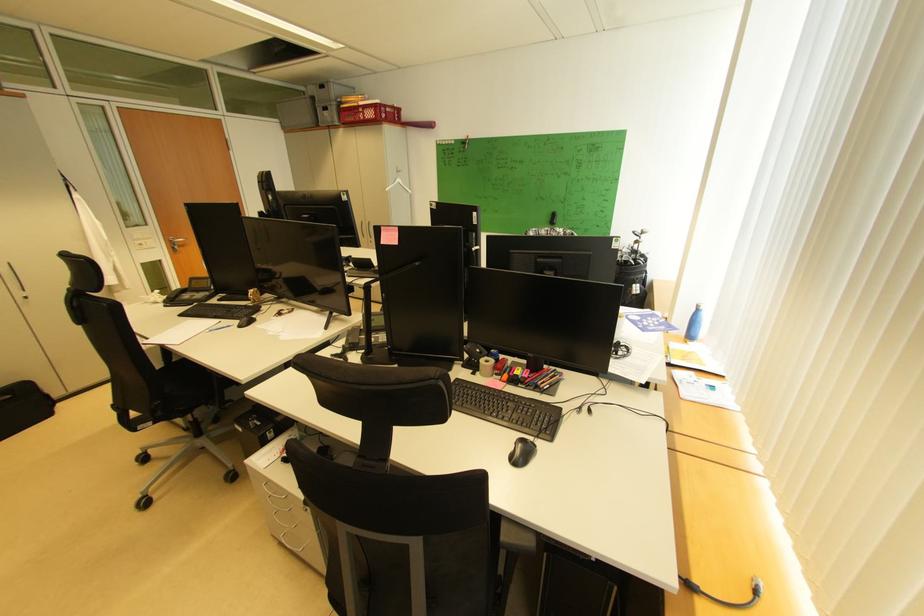
Describe the element at coordinates (694, 323) in the screenshot. This screenshot has width=924, height=616. I see `the blue water bottle` at that location.